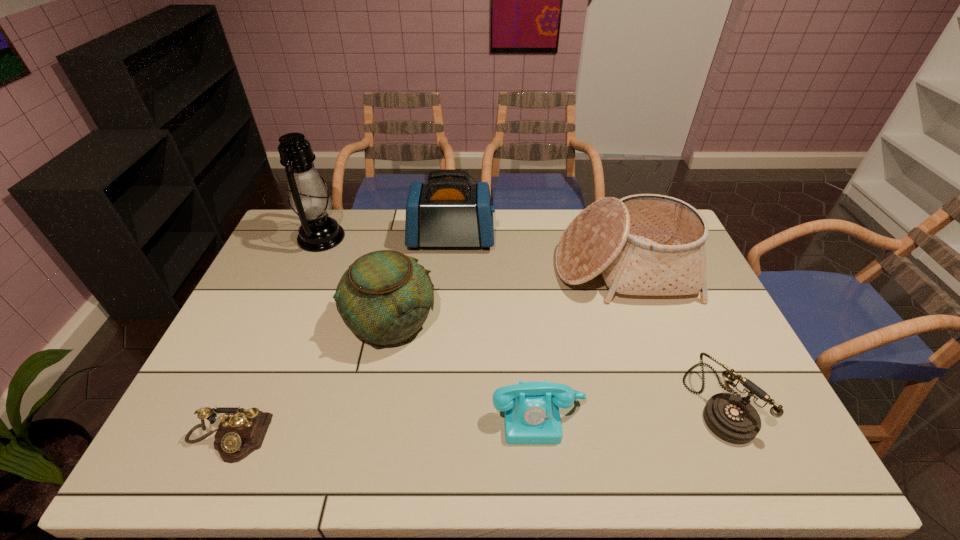
What are the coordinates of `telephone that is the closest one to the tallest object` in the screenshot? It's located at (242, 431).

I want to click on telephone that can be found as the third closest to the fourth tallest object, so click(732, 418).

At what (x,y) coordinates should I click in order to perform the action: click on free space that satisfies the following two spatial constraints: 1. on the front-facing side of the toaster; 2. on the back side of the rightmost telephone. Please return your answer as a coordinate pair (x, y). This screenshot has height=540, width=960. Looking at the image, I should click on (439, 401).

This screenshot has width=960, height=540. I want to click on free space in the image that satisfies the following two spatial constraints: 1. on the front-facing side of the rightmost telephone; 2. on the right side of the toaster, so click(439, 401).

Find the location of a particular element. The height and width of the screenshot is (540, 960). vacant space that satisfies the following two spatial constraints: 1. on the front-facing side of the toaster; 2. on the back side of the rightmost telephone is located at coordinates (439, 401).

The height and width of the screenshot is (540, 960). What are the coordinates of `free location that satisfies the following two spatial constraints: 1. on the front-facing side of the toaster; 2. on the right side of the rightmost telephone` in the screenshot? It's located at (439, 401).

Identify the location of free spot that satisfies the following two spatial constraints: 1. on the front-facing side of the rightmost telephone; 2. on the left side of the toaster. (439, 401).

Locate an element on the screen. Image resolution: width=960 pixels, height=540 pixels. free space that satisfies the following two spatial constraints: 1. on the front-facing side of the rightmost telephone; 2. on the right side of the toaster is located at coordinates (439, 401).

The image size is (960, 540). I want to click on free space that satisfies the following two spatial constraints: 1. on the front-facing side of the rightmost telephone; 2. on the left side of the toaster, so click(x=439, y=401).